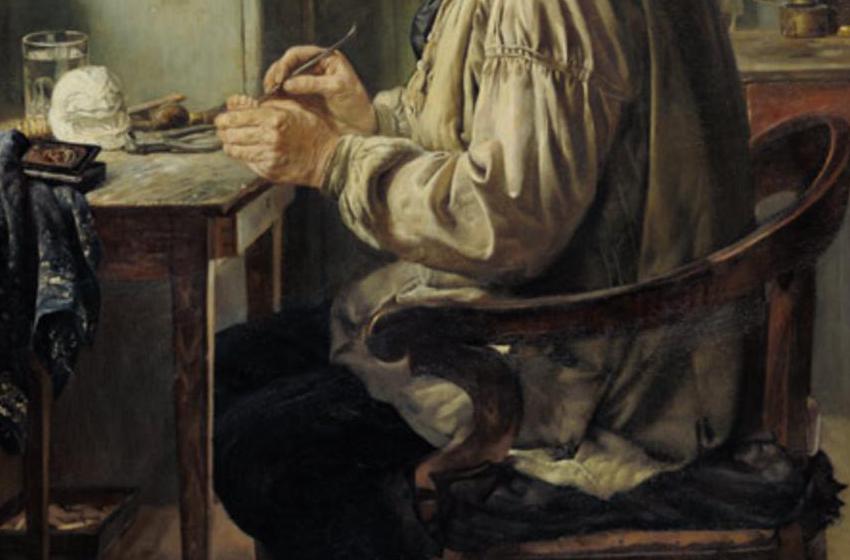
At what (x,y) coordinates should I click in order to perform the action: click on table. Please return your answer as a coordinate pair (x, y). Looking at the image, I should click on (148, 206), (183, 169), (191, 176), (125, 167).